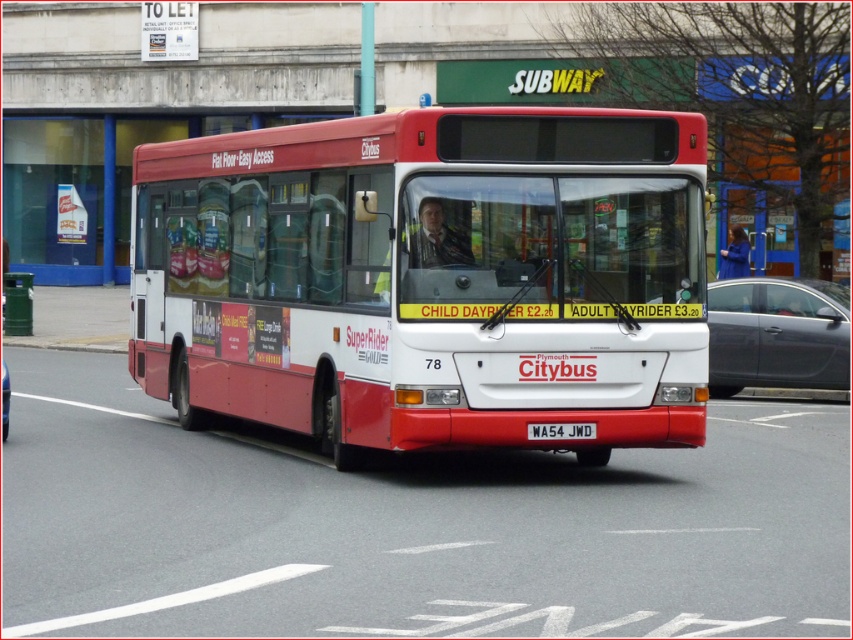
Is white metallic license plate at center further to camera compared to metallic gray car at center?

No, it is in front of metallic gray car at center.

Measure the distance between white metallic license plate at center and camera.

The distance of white metallic license plate at center from camera is 10.33 meters.

The width and height of the screenshot is (853, 640). In order to click on white metallic license plate at center in this screenshot , I will do `click(561, 429)`.

Does matte red bus at center have a greater width compared to metallic gray sedan at center?

No, matte red bus at center is not wider than metallic gray sedan at center.

Who is more distant from viewer, (296, 211) or (837, 356)?

Point (837, 356)

Looking at this image, who is more forward, (x=157, y=296) or (x=732, y=296)?

Point (x=157, y=296) is more forward.

You are a GUI agent. You are given a task and a screenshot of the screen. Output one action in this format:
    pyautogui.click(x=<x>, y=<y>)
    Task: Click on the matte red bus at center
    
    Given the screenshot: What is the action you would take?
    pyautogui.click(x=428, y=278)

Looking at this image, does matte red bus at center appear on the left side of metallic gray car at center?

In fact, matte red bus at center is to the right of metallic gray car at center.

Can you confirm if matte red bus at center is thinner than metallic gray car at center?

Yes, matte red bus at center is thinner than metallic gray car at center.

Locate an element on the screen. matte red bus at center is located at coordinates (428, 278).